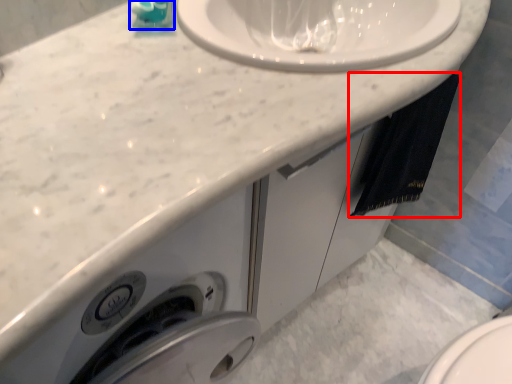
Question: Which object appears farthest to the camera in this image, bath towel (highlighted by a red box) or soap dispenser (highlighted by a blue box)?

Choices:
 (A) bath towel
 (B) soap dispenser

Answer: (A)